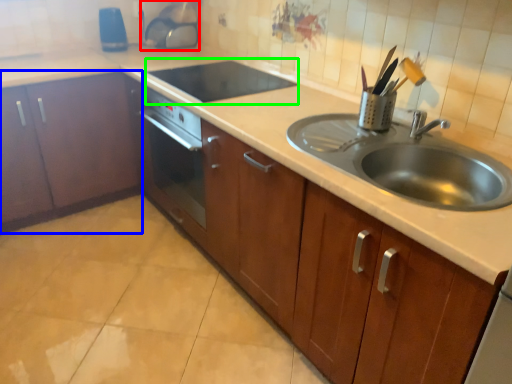
Question: Based on their relative distances, which object is nearer to appliance (highlighted by a red box)? Choose from cabinetry (highlighted by a blue box) and appliance (highlighted by a green box).

Choices:
 (A) cabinetry
 (B) appliance

Answer: (B)